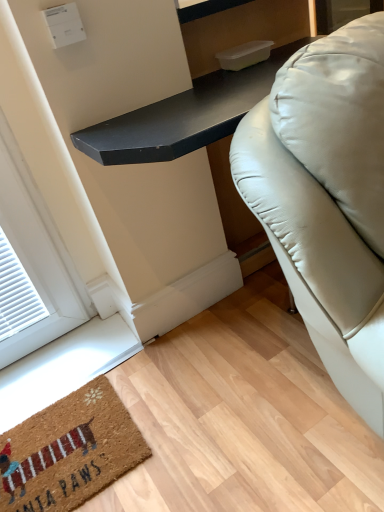
Where is `vacant region above brown coir mat at lower left (from a real-world perspective)`? The height and width of the screenshot is (512, 384). vacant region above brown coir mat at lower left (from a real-world perspective) is located at coordinates (67, 445).